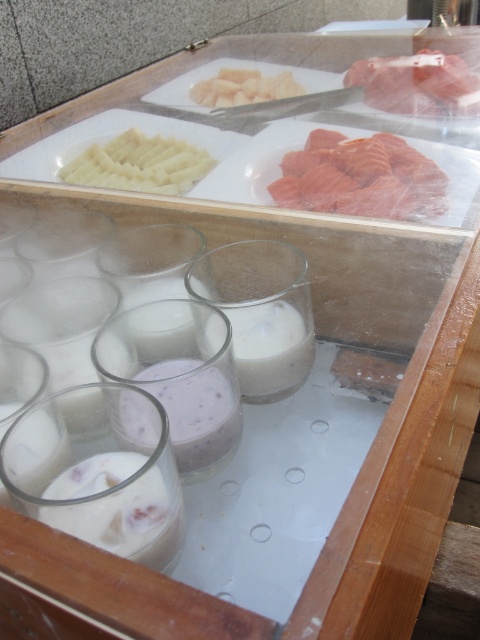
Measure the distance from white creamy milk at center to pinkish raw meat at upper right.

A distance of 1.13 meters exists between white creamy milk at center and pinkish raw meat at upper right.

Which is behind, point (248, 316) or point (454, 67)?

Positioned behind is point (454, 67).

At what (x,y) coordinates should I click in order to perform the action: click on white creamy milk at center. Please return your answer as a coordinate pair (x, y). The image size is (480, 640). Looking at the image, I should click on (271, 348).

Can you confirm if pinkish-orange flesh at upper right is shorter than purple creamy smoothie at center?

No, pinkish-orange flesh at upper right is not shorter than purple creamy smoothie at center.

Looking at this image, is pinkish-orange flesh at upper right bigger than purple creamy smoothie at center?

Yes.

Which is in front, point (317, 188) or point (204, 376)?

Positioned in front is point (204, 376).

Locate an element on the screen. The height and width of the screenshot is (640, 480). pinkish-orange flesh at upper right is located at coordinates (360, 177).

Measure the distance from purple creamy smoothie at center to white creamy sliced potatoes at upper left.

purple creamy smoothie at center and white creamy sliced potatoes at upper left are 75.94 centimeters apart from each other.

Who is lower down, purple creamy smoothie at center or white creamy sliced potatoes at upper left?

purple creamy smoothie at center

Is point (156, 392) closer to viewer compared to point (103, 172)?

That is True.

I want to click on purple creamy smoothie at center, so click(x=195, y=412).